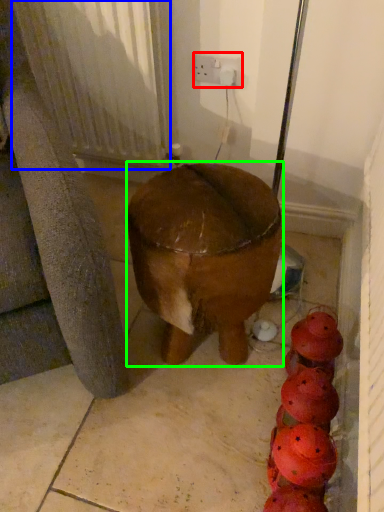
Question: Which is farther away from electric outlet (highlighted by a red box)? radiator (highlighted by a blue box) or furniture (highlighted by a green box)?

Choices:
 (A) radiator
 (B) furniture

Answer: (B)